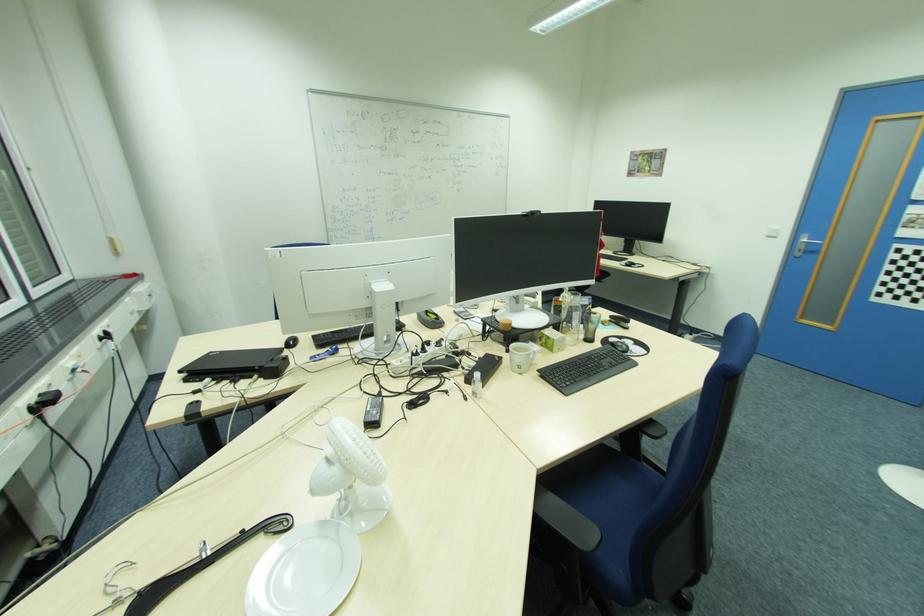
Where would you lift the mug handle? Please return your answer as a coordinate pair (x, y).

(535, 351)